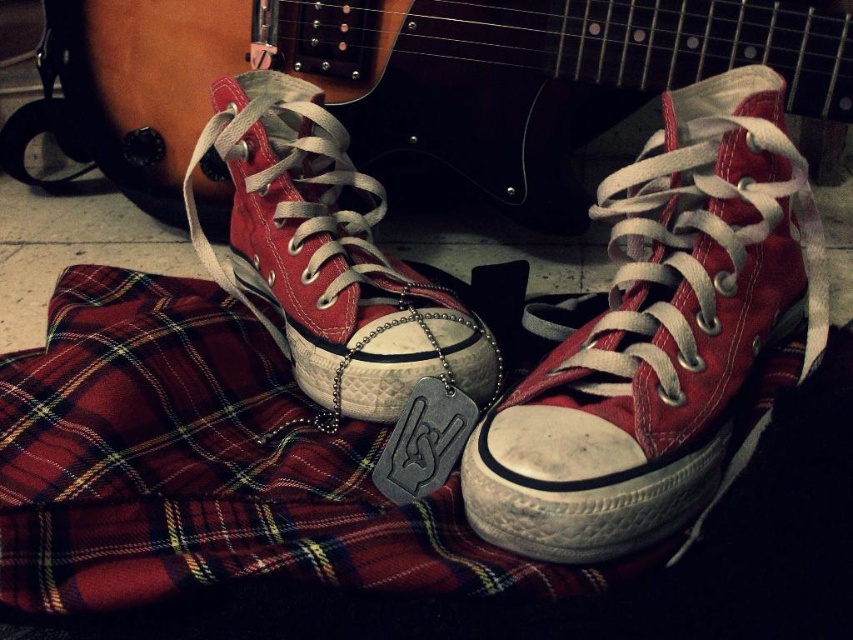
Does matte canvas sneaker at center appear over matte canvas shoe at center?

No.

Who is more forward, (691,253) or (335,401)?

Positioned in front is point (691,253).

Is point (724, 193) behind point (329, 138)?

That is False.

I want to click on matte canvas sneaker at center, so click(659, 336).